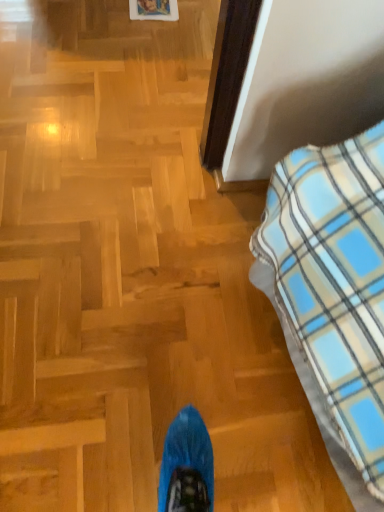
Question: In terms of width, does wooden picture frame at upper center look wider or thinner when compared to blue plaid blanket at right?

Choices:
 (A) thin
 (B) wide

Answer: (A)

Question: Is point (142, 12) closer or farther from the camera than point (297, 345)?

Choices:
 (A) farther
 (B) closer

Answer: (A)

Question: Is wooden picture frame at upper center situated inside blue plaid blanket at right or outside?

Choices:
 (A) inside
 (B) outside

Answer: (B)

Question: From the image's perspective, is blue plaid blanket at right located above or below wooden picture frame at upper center?

Choices:
 (A) above
 (B) below

Answer: (B)

Question: Would you say blue plaid blanket at right is to the left or to the right of wooden picture frame at upper center in the picture?

Choices:
 (A) right
 (B) left

Answer: (A)

Question: Does point (294, 165) appear closer or farther from the camera than point (165, 6)?

Choices:
 (A) closer
 (B) farther

Answer: (A)

Question: From a real-world perspective, is blue plaid blanket at right positioned above or below wooden picture frame at upper center?

Choices:
 (A) above
 (B) below

Answer: (A)